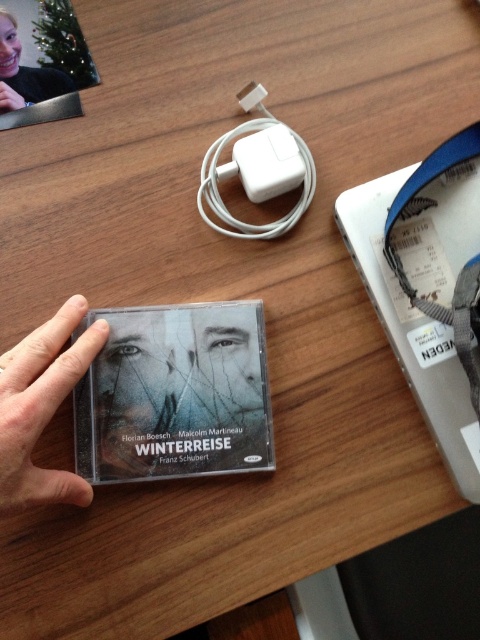
Who is positioned more to the left, white plastic charger at center or matte black face at upper left?

From the viewer's perspective, matte black face at upper left appears more on the left side.

Is point (231, 168) more distant than point (4, 83)?

That is False.

This screenshot has width=480, height=640. Identify the location of white plastic charger at center. (239, 172).

Looking at this image, who is more distant from viewer, (0, 369) or (215, 172)?

Point (215, 172)

Which is in front, point (56, 492) or point (235, 234)?

Point (56, 492) is in front.

Is point (8, 352) farther from camera compared to point (280, 220)?

That is False.

What are the coordinates of `smooth skin hand at lower left` in the screenshot? It's located at (41, 406).

Between smooth skin hand at lower left and matte black face at upper left, which one has less height?

With less height is matte black face at upper left.

Does smooth skin hand at lower left appear on the right side of matte black face at upper left?

Correct, you'll find smooth skin hand at lower left to the right of matte black face at upper left.

Which is behind, point (12, 381) or point (3, 16)?

The point (3, 16) is behind.

Locate an element on the screen. The height and width of the screenshot is (640, 480). smooth skin hand at lower left is located at coordinates [x=41, y=406].